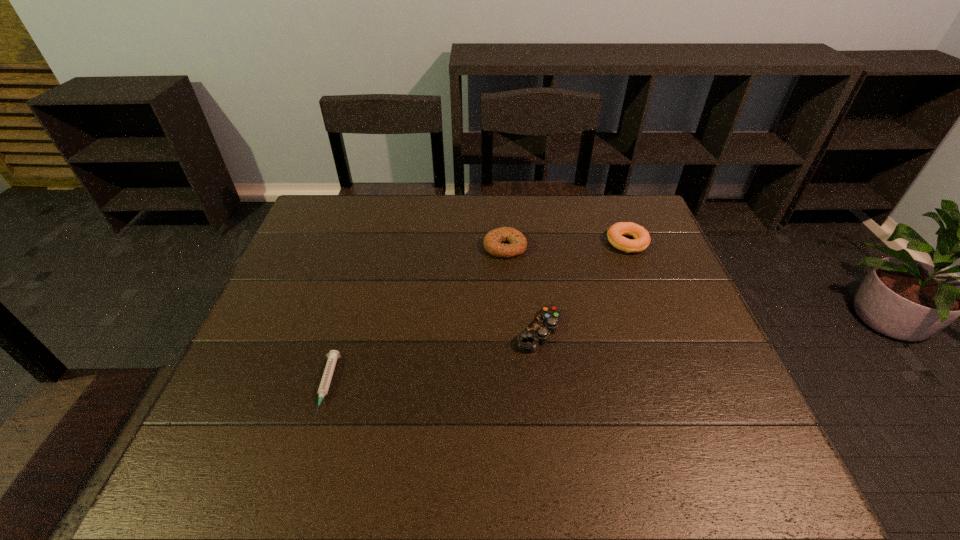
Find the location of `object that is the third nearest to the shortest object`. object that is the third nearest to the shortest object is located at coordinates (615, 233).

Where is `object that is the closest to the second nearest object`? The height and width of the screenshot is (540, 960). object that is the closest to the second nearest object is located at coordinates (494, 240).